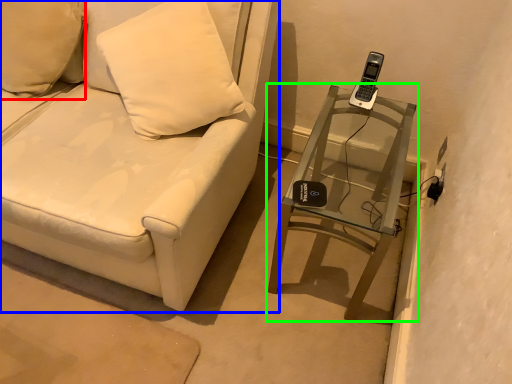
Question: Which is nearer to the pillow (highlighted by a red box)? furniture (highlighted by a blue box) or table (highlighted by a green box).

Choices:
 (A) furniture
 (B) table

Answer: (A)